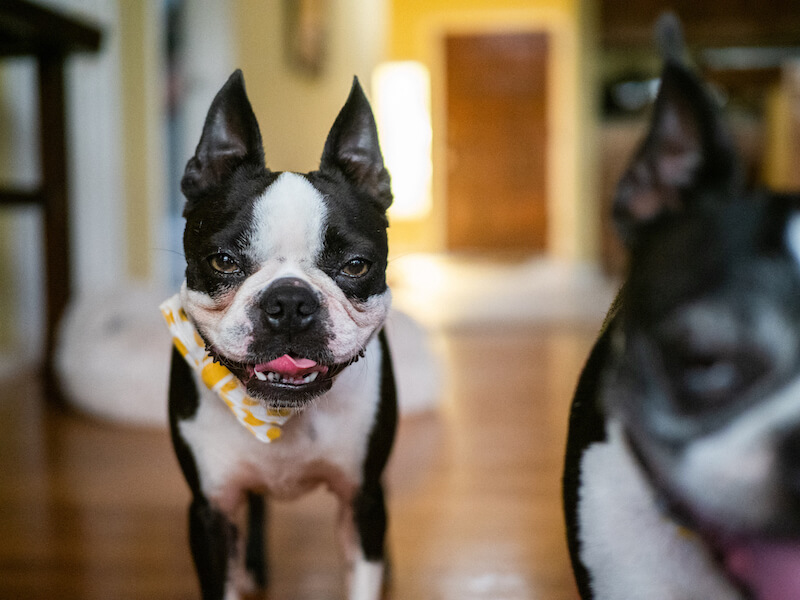
In order to click on white dog bed in this screenshot , I will do `click(130, 348)`, `click(120, 316)`, `click(101, 381)`, `click(420, 372)`.